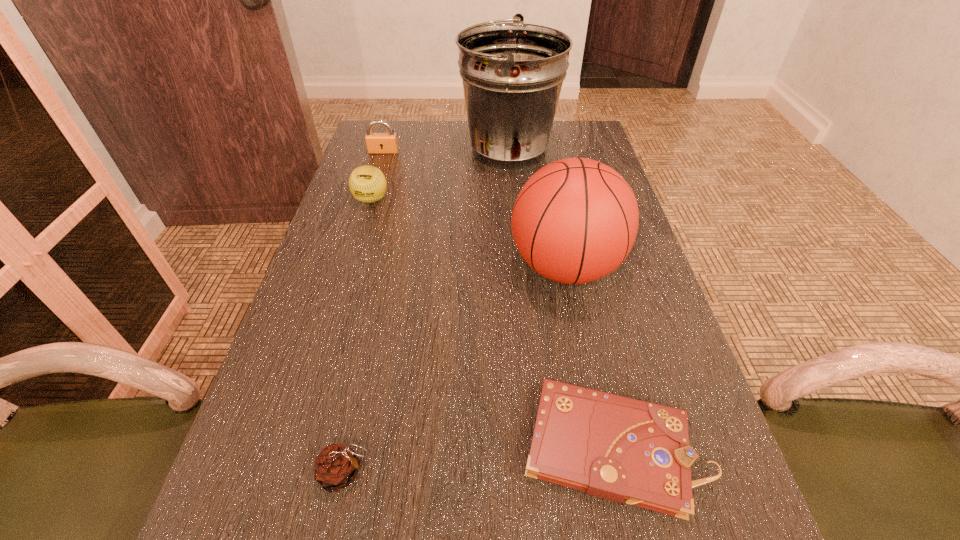
The image size is (960, 540). What are the coordinates of `the tallest object` in the screenshot? It's located at (512, 73).

Identify the location of the third nearest object. This screenshot has width=960, height=540. [575, 220].

At what (x,y) coordinates should I click in order to perform the action: click on the fifth shortest object. Please return your answer as a coordinate pair (x, y). Image resolution: width=960 pixels, height=540 pixels. Looking at the image, I should click on (575, 220).

Identify the location of padlock. This screenshot has width=960, height=540. (377, 143).

At what (x,y) coordinates should I click in order to perform the action: click on softball. Please return your answer as a coordinate pair (x, y). This screenshot has height=540, width=960. Looking at the image, I should click on (367, 184).

At what (x,y) coordinates should I click in order to perform the action: click on pinecone. Please return your answer as a coordinate pair (x, y). Image resolution: width=960 pixels, height=540 pixels. Looking at the image, I should click on (336, 467).

At what (x,y) coordinates should I click in order to perform the action: click on notebook. Please return your answer as a coordinate pair (x, y). Looking at the image, I should click on (617, 448).

In order to click on blank area located on the left of the bucket in this screenshot , I will do `click(420, 150)`.

You are a GUI agent. You are given a task and a screenshot of the screen. Output one action in this format:
    pyautogui.click(x=<x>, y=<y>)
    Task: Click on the free space located 0.360m on the left of the third nearest object
    The width and height of the screenshot is (960, 540).
    Given the screenshot: What is the action you would take?
    pyautogui.click(x=350, y=267)

The image size is (960, 540). What are the coordinates of `blank space located 0.070m to unlock the padlock from the front` in the screenshot? It's located at (379, 166).